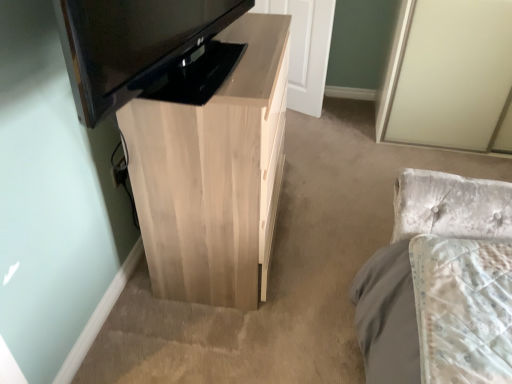
Question: Considering the positions of point (302, 23) and point (76, 46), is point (302, 23) closer or farther from the camera than point (76, 46)?

Choices:
 (A) closer
 (B) farther

Answer: (B)

Question: In terms of height, does white wood door at center look taller or shorter compared to black glossy television at upper left?

Choices:
 (A) tall
 (B) short

Answer: (A)

Question: Which is farther from the white wood door at center?

Choices:
 (A) light wood cabinet at center
 (B) black glossy television at upper left

Answer: (B)

Question: Which is farther from the white wood door at center?

Choices:
 (A) black glossy television at upper left
 (B) light wood cabinet at center

Answer: (A)